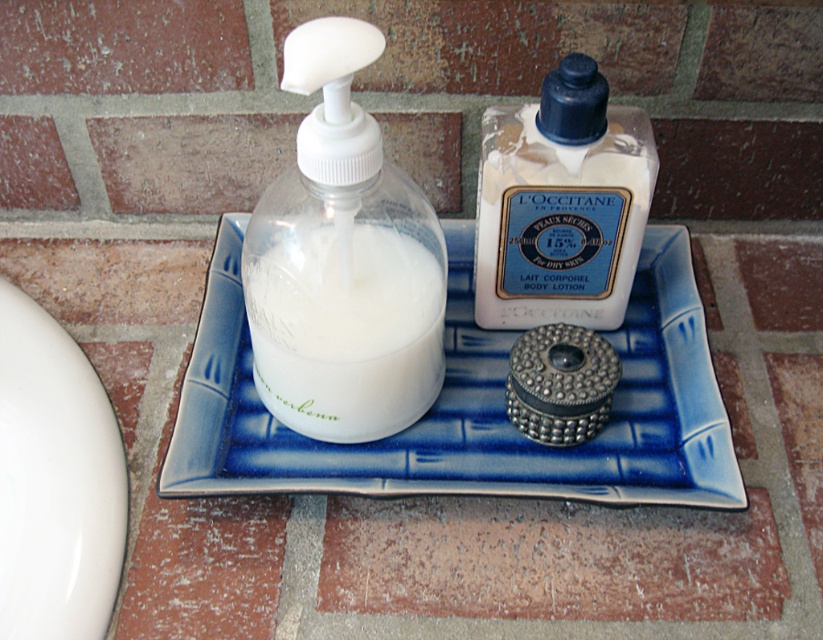
Question: Which point is farther from the camera taking this photo?

Choices:
 (A) (431, 376)
 (B) (480, 256)
 (C) (122, 556)
 (D) (689, 500)

Answer: (B)

Question: Observing the image, what is the correct spatial positioning of blue ceramic tray at center in reference to white matte lotion at center?

Choices:
 (A) below
 (B) above

Answer: (A)

Question: In this image, where is blue ceramic tray at center located relative to white matte lotion at center?

Choices:
 (A) right
 (B) left

Answer: (B)

Question: Among these objects, which one is nearest to the camera?

Choices:
 (A) white glossy plate at lower left
 (B) white matte lotion at center
 (C) blue ceramic tray at center

Answer: (A)

Question: Is white glossy plate at lower left to the left of white matte lotion at center from the viewer's perspective?

Choices:
 (A) no
 (B) yes

Answer: (B)

Question: Considering the real-world distances, which object is closest to the white opaque liquid at center?

Choices:
 (A) blue ceramic tray at center
 (B) white matte lotion at center

Answer: (A)